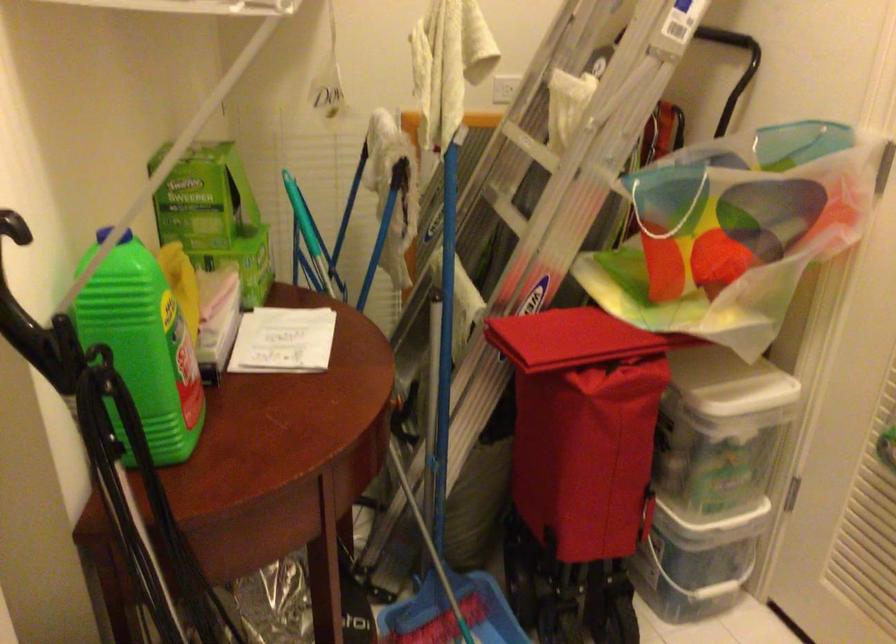
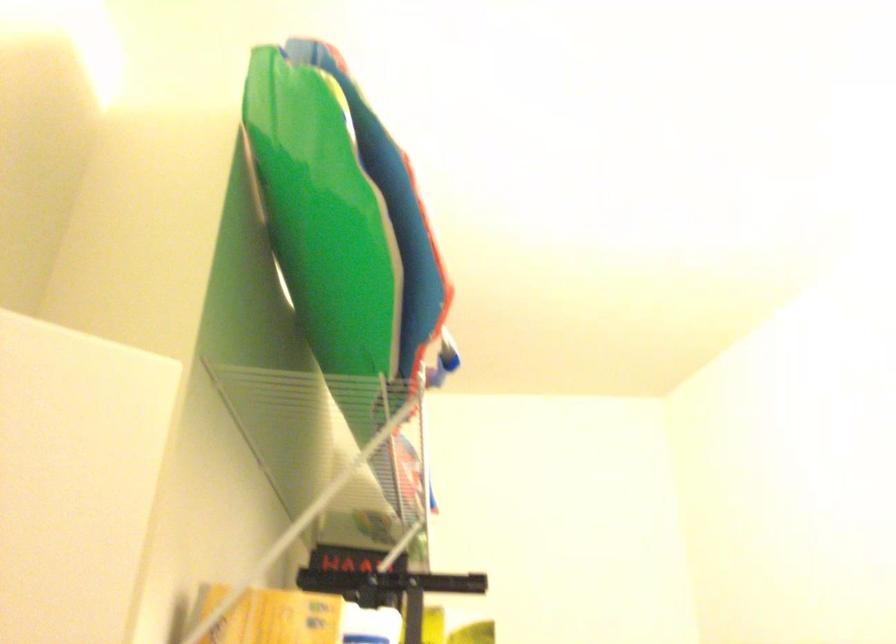
Question: How did the camera likely rotate?

Choices:
 (A) Left
 (B) Right
 (C) Up
 (D) Down

Answer: (C)